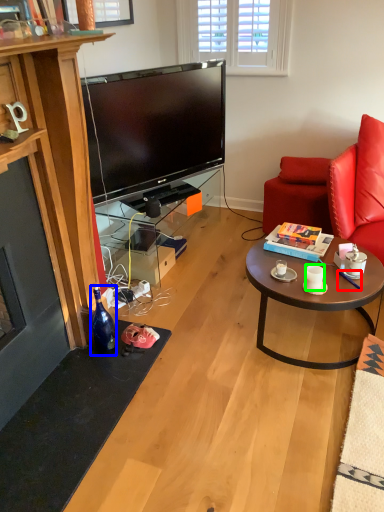
Question: Which object is positioned closest to pen (highlighted by a red box)? Select from bottle (highlighted by a blue box) and coffee cup (highlighted by a green box).

Choices:
 (A) bottle
 (B) coffee cup

Answer: (B)